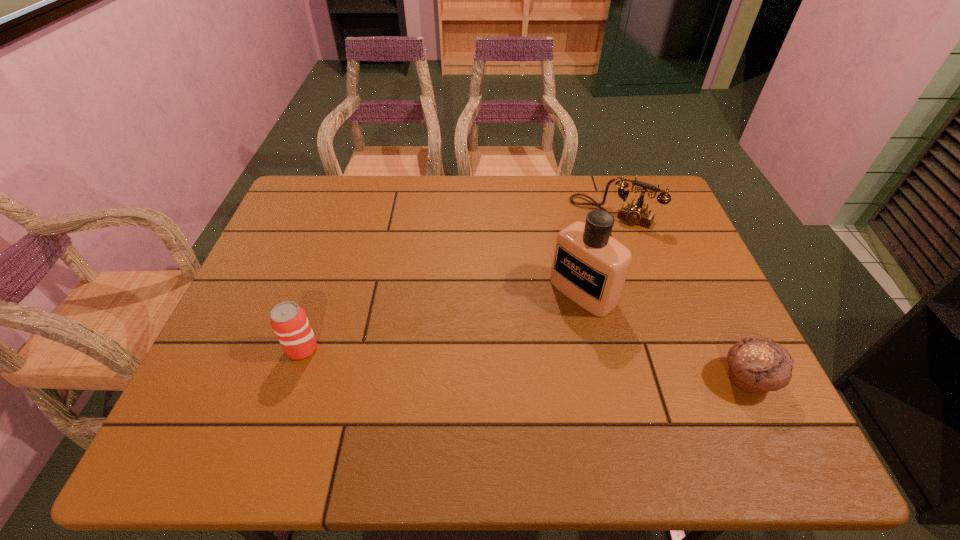
Image resolution: width=960 pixels, height=540 pixels. I want to click on vacant space in between the shortest object and the tallest object, so click(x=665, y=336).

What are the coordinates of `free space between the shortest object and the telephone` in the screenshot? It's located at (681, 296).

You are a GUI agent. You are given a task and a screenshot of the screen. Output one action in this format:
    pyautogui.click(x=<x>, y=<y>)
    Task: Click on the free space between the third nearest object and the beer can
    Image resolution: width=960 pixels, height=540 pixels.
    Given the screenshot: What is the action you would take?
    tap(443, 320)

This screenshot has width=960, height=540. Identify the location of blank region between the leftmost object and the muffin. (525, 364).

Identify which object is the closest to the leftmost object. Please provide its 2D coordinates. Your answer should be formatted as a tuple, i.e. [(x, y)], where the tuple contains the x and y coordinates of a point satisfying the conditions above.

[(590, 267)]

You are a GUI agent. You are given a task and a screenshot of the screen. Output one action in this format:
    pyautogui.click(x=<x>, y=<y>)
    Task: Click on the object that ranks as the third closest to the tallest object
    
    Given the screenshot: What is the action you would take?
    pyautogui.click(x=289, y=321)

Identify the location of free spot that satisfies the following two spatial constraints: 1. on the front side of the muffin; 2. on the right side of the third nearest object. (602, 379).

The height and width of the screenshot is (540, 960). I want to click on free spot that satisfies the following two spatial constraints: 1. on the back side of the leftmost object; 2. on the right side of the farthest object, so click(348, 212).